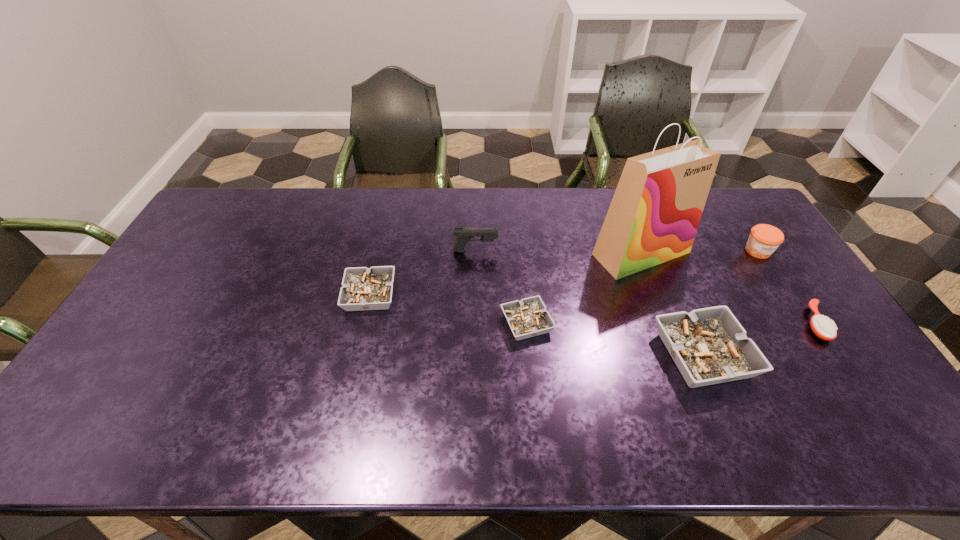
The height and width of the screenshot is (540, 960). In order to click on vacant region between the tallest object and the pistol in this screenshot , I will do `click(559, 252)`.

At what (x,y) coordinates should I click in order to perform the action: click on free space between the shopping bag and the third tallest object. Please return your answer as a coordinate pair (x, y). This screenshot has height=540, width=960. Looking at the image, I should click on (700, 252).

This screenshot has height=540, width=960. I want to click on free point between the hairbrush and the fifth shortest object, so click(786, 287).

Locate an element on the screen. free space between the second shortest ashtray and the tallest object is located at coordinates coord(506,274).

The height and width of the screenshot is (540, 960). I want to click on object that ranks as the third closest to the sixth shortest object, so click(654, 215).

Point out which object is positioned as the fifth nearest to the fourth tallest object. Please provide its 2D coordinates. Your answer should be formatted as a tuple, i.e. [(x, y)], where the tuple contains the x and y coordinates of a point satisfying the conditions above.

[(464, 235)]

Locate an element on the screen. The image size is (960, 540). ashtray that is the second nearest to the tallest object is located at coordinates (527, 318).

Locate an element on the screen. The height and width of the screenshot is (540, 960). ashtray that is the nearest to the shortest ashtray is located at coordinates (709, 346).

Locate an element on the screen. The width and height of the screenshot is (960, 540). free region that satisfies the following two spatial constraints: 1. at the barrel of the pistol; 2. on the right side of the hairbrush is located at coordinates (474, 323).

The image size is (960, 540). I want to click on vacant space that satisfies the following two spatial constraints: 1. on the back side of the tallest ashtray; 2. at the barrel of the second tallest object, so click(x=660, y=251).